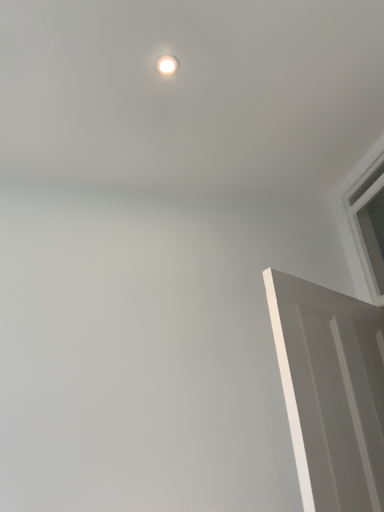
What do you see at coordinates (331, 391) in the screenshot? The width and height of the screenshot is (384, 512). I see `white matte door at right` at bounding box center [331, 391].

The image size is (384, 512). What do you see at coordinates (369, 225) in the screenshot?
I see `white plastic window at upper right` at bounding box center [369, 225].

What is the approximate width of white plastic window at upper right?

The width of white plastic window at upper right is 14.09 centimeters.

Identify the location of white glossy light fixture at upper center. The width and height of the screenshot is (384, 512). 167,65.

Is white plastic window at upper right aimed at white glossy light fixture at upper center?

Yes, white plastic window at upper right is aimed at white glossy light fixture at upper center.

Between white plastic window at upper right and white glossy light fixture at upper center, which one has larger width?

Wider between the two is white plastic window at upper right.

The width and height of the screenshot is (384, 512). Identify the location of window below the white glossy light fixture at upper center (from a real-world perspective). (369, 225).

In the scene shown: What's the angular difference between white plastic window at upper right and white glossy light fixture at upper center's facing directions?

The angle between the facing direction of white plastic window at upper right and the facing direction of white glossy light fixture at upper center is 2.89 degrees.

Considering the relative positions of white matte door at right and white glossy light fixture at upper center in the image provided, is white matte door at right to the left of white glossy light fixture at upper center from the viewer's perspective?

In fact, white matte door at right is to the right of white glossy light fixture at upper center.

Would you say white matte door at right is inside or outside white glossy light fixture at upper center?

The correct answer is: outside.

From the picture: Could you tell me if white matte door at right is facing white glossy light fixture at upper center?

No, white matte door at right is not turned towards white glossy light fixture at upper center.

In the scene shown: How distant is white matte door at right from white glossy light fixture at upper center?

A distance of 1.16 meters exists between white matte door at right and white glossy light fixture at upper center.

Which of these two, white glossy light fixture at upper center or white matte door at right, stands taller?

white matte door at right.

Is white glossy light fixture at upper center completely or partially outside of white matte door at right?

Yes, white glossy light fixture at upper center is not within white matte door at right.

From a real-world perspective, is white glossy light fixture at upper center physically above white matte door at right?

Yes, from a real-world perspective, white glossy light fixture at upper center is on top of white matte door at right.

Are white matte door at right and white plastic window at upper right making contact?

No, white matte door at right is not beside white plastic window at upper right.

Considering the sizes of objects white matte door at right and white plastic window at upper right in the image provided, who is thinner, white matte door at right or white plastic window at upper right?

With smaller width is white plastic window at upper right.

Is the depth of white matte door at right less than that of white plastic window at upper right?

Yes, it is.

At what (x,y) coordinates should I click in order to perform the action: click on door located on the left of white plastic window at upper right. Please return your answer as a coordinate pair (x, y). This screenshot has width=384, height=512. Looking at the image, I should click on (331, 391).

Which is behind, point (380, 277) or point (312, 390)?

The point (380, 277) is more distant.

Who is smaller, white plastic window at upper right or white matte door at right?

white plastic window at upper right is smaller.

Can you confirm if white plastic window at upper right is taller than white matte door at right?

Incorrect, the height of white plastic window at upper right is not larger of that of white matte door at right.

From a real-world perspective, is white plastic window at upper right positioned above or below white matte door at right?

white plastic window at upper right is above white matte door at right.

From the image's perspective, which is above, white glossy light fixture at upper center or white plastic window at upper right?

white glossy light fixture at upper center, from the image's perspective.

Is point (171, 68) less distant than point (372, 269)?

Yes, point (171, 68) is in front of point (372, 269).

Where is `lighting above the white plastic window at upper right (from a real-world perspective)`? The image size is (384, 512). lighting above the white plastic window at upper right (from a real-world perspective) is located at coordinates (167, 65).

Is white glossy light fixture at upper center directly adjacent to white plastic window at upper right?

white glossy light fixture at upper center and white plastic window at upper right are not in contact.

The height and width of the screenshot is (512, 384). In order to click on window behind the white glossy light fixture at upper center in this screenshot , I will do `click(369, 225)`.

This screenshot has height=512, width=384. What are the coordinates of `lighting that is above the white matte door at right (from the image's perspective)` in the screenshot? It's located at (167, 65).

Estimate the real-world distances between objects in this image. Which object is further from white matte door at right, white plastic window at upper right or white glossy light fixture at upper center?

white glossy light fixture at upper center.

Looking at the image, which one is located closer to white glossy light fixture at upper center, white matte door at right or white plastic window at upper right?

white matte door at right.

Looking at the image, which one is located further to white matte door at right, white glossy light fixture at upper center or white plastic window at upper right?

Based on the image, white glossy light fixture at upper center appears to be further to white matte door at right.

Based on their spatial positions, is white matte door at right or white glossy light fixture at upper center further from white plastic window at upper right?

white glossy light fixture at upper center is positioned further to the anchor white plastic window at upper right.

Considering their positions, is white plastic window at upper right positioned closer to white glossy light fixture at upper center than white matte door at right?

white matte door at right is positioned closer to the anchor white glossy light fixture at upper center.

Estimate the real-world distances between objects in this image. Which object is further from white plastic window at upper right, white glossy light fixture at upper center or white matte door at right?

white glossy light fixture at upper center lies further to white plastic window at upper right than the other object.

This screenshot has width=384, height=512. What are the coordinates of `window between white glossy light fixture at upper center and white matte door at right in the up-down direction` in the screenshot? It's located at (369, 225).